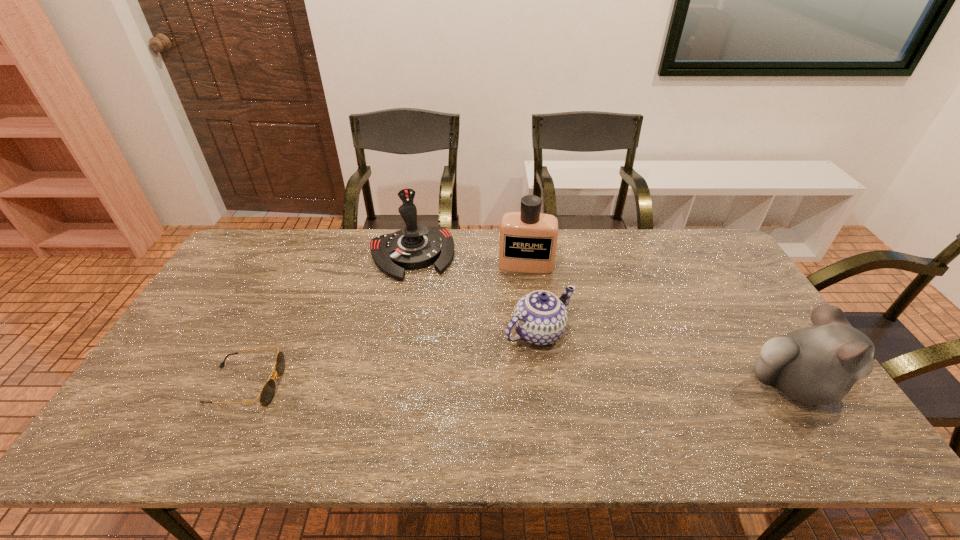
Where is `free location located 0.100m on the front label of the perfume`? The image size is (960, 540). free location located 0.100m on the front label of the perfume is located at coordinates (523, 295).

Image resolution: width=960 pixels, height=540 pixels. Find the location of `free space located at the spout of the fourth tallest object`. free space located at the spout of the fourth tallest object is located at coordinates click(612, 398).

Where is `free space located 0.100m at the spout of the fourth tallest object`? This screenshot has width=960, height=540. free space located 0.100m at the spout of the fourth tallest object is located at coordinates (588, 376).

Find the location of a particular element. This screenshot has height=540, width=960. vacant region located 0.100m at the spout of the fourth tallest object is located at coordinates (588, 376).

Identify the location of free space located on the handle side of the fourth object from right to left. This screenshot has height=540, width=960. (440, 354).

Find the location of a particular element. This screenshot has height=540, width=960. vacant space located on the handle side of the fourth object from right to left is located at coordinates (444, 368).

Where is `vacant point located 0.310m on the handle side of the fourth object from right to left`? The height and width of the screenshot is (540, 960). vacant point located 0.310m on the handle side of the fourth object from right to left is located at coordinates (440, 354).

Find the location of a particular element. Image resolution: width=960 pixels, height=540 pixels. perfume at the far edge is located at coordinates (528, 239).

The width and height of the screenshot is (960, 540). I want to click on joystick at the far edge, so click(x=416, y=246).

This screenshot has width=960, height=540. Find the location of `sunglasses present at the near edge`. sunglasses present at the near edge is located at coordinates (267, 393).